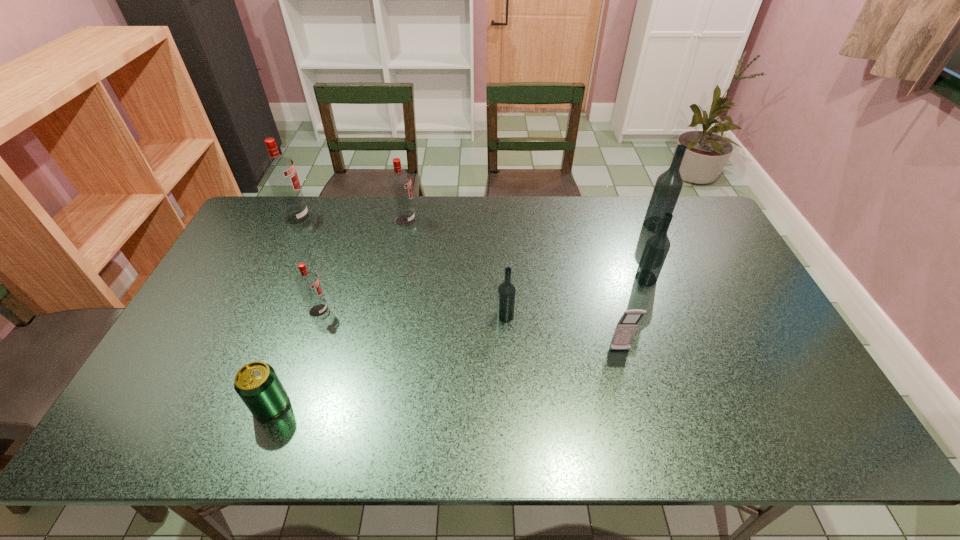
Where is `free spot located 0.150m on the front label of the smallest red vodka`? The image size is (960, 540). free spot located 0.150m on the front label of the smallest red vodka is located at coordinates (381, 311).

Find the location of `free region located on the back of the leftmost black vodka`. free region located on the back of the leftmost black vodka is located at coordinates (501, 231).

The height and width of the screenshot is (540, 960). I want to click on vacant space located 0.050m on the front-facing side of the sixth object from left to right, so click(x=625, y=370).

The width and height of the screenshot is (960, 540). Find the location of `blank space located on the back of the green beer can`. blank space located on the back of the green beer can is located at coordinates (289, 355).

Image resolution: width=960 pixels, height=540 pixels. Find the location of `object positioned at the near edge`. object positioned at the near edge is located at coordinates (x=257, y=384).

Find the location of `object positioned at the left edge`. object positioned at the left edge is located at coordinates (280, 171).

The height and width of the screenshot is (540, 960). Identify the location of object present at the right edge. (668, 186).

Identify the location of object at the far left corner. The width and height of the screenshot is (960, 540). (280, 171).

Where is `object that is at the far right corner`? The width and height of the screenshot is (960, 540). object that is at the far right corner is located at coordinates (668, 186).

Identify the location of vacant space at the far edge of the desktop. (385, 207).